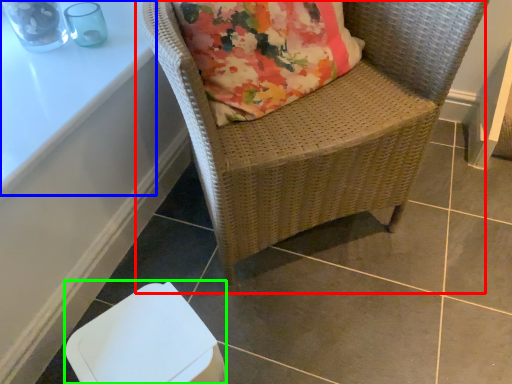
Question: Which is nearer to the chair (highlighted by a red box)? table (highlighted by a blue box) or swivel chair (highlighted by a green box).

Choices:
 (A) table
 (B) swivel chair

Answer: (B)